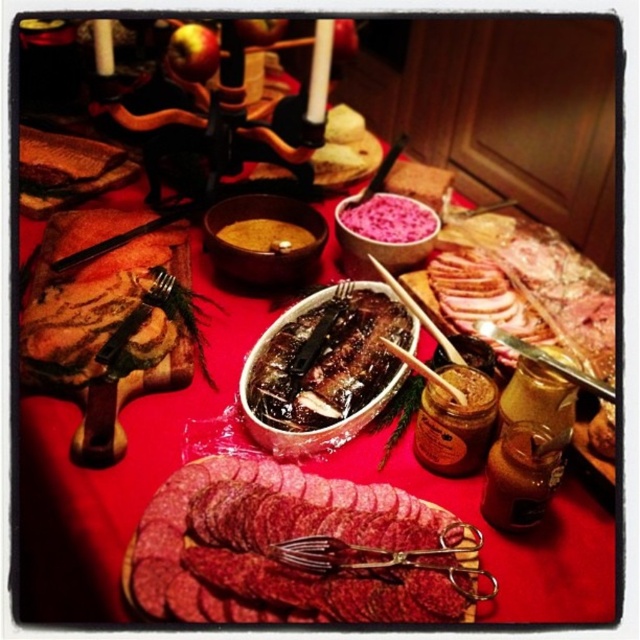
Question: Is sliced reddish-pink cured meat at center below shiny brown bowl at center?

Choices:
 (A) yes
 (B) no

Answer: (A)

Question: Which of the following is the farthest from the observer?

Choices:
 (A) shiny brown bowl at center
 (B) pink fluffy rice at center
 (C) shiny dark brown meat at center

Answer: (B)

Question: Which of the following is the farthest from the observer?

Choices:
 (A) (323, 545)
 (B) (401, 326)

Answer: (B)

Question: Is shiny dark brown meat at center further to the viewer compared to shiny brown bowl at center?

Choices:
 (A) yes
 (B) no

Answer: (B)

Question: Which of the following is the closest to the observer?

Choices:
 (A) (420, 234)
 (B) (291, 384)
 (C) (424, 577)
 (D) (284, 234)

Answer: (C)

Question: Is pink fluffy rice at center in front of shiny brown bowl at center?

Choices:
 (A) no
 (B) yes

Answer: (A)